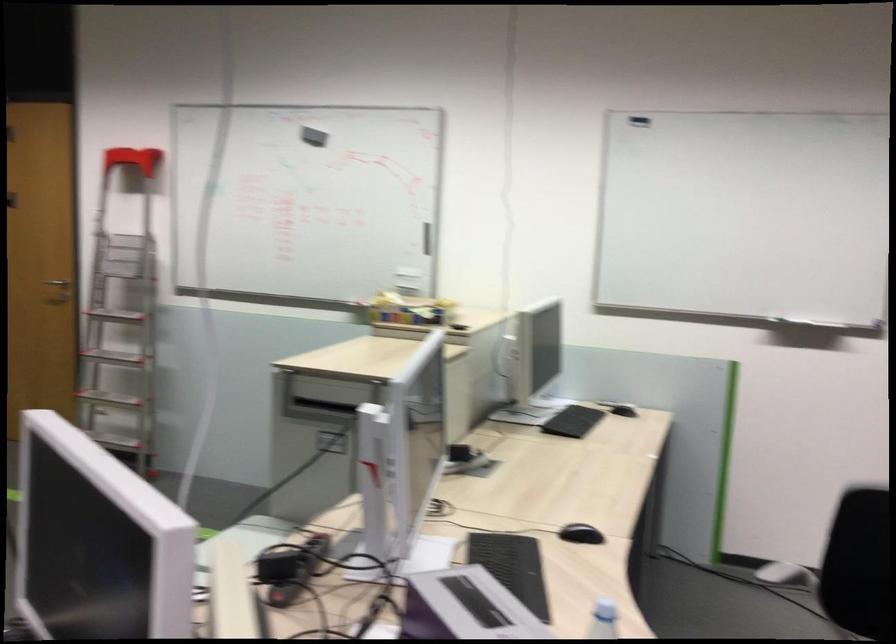
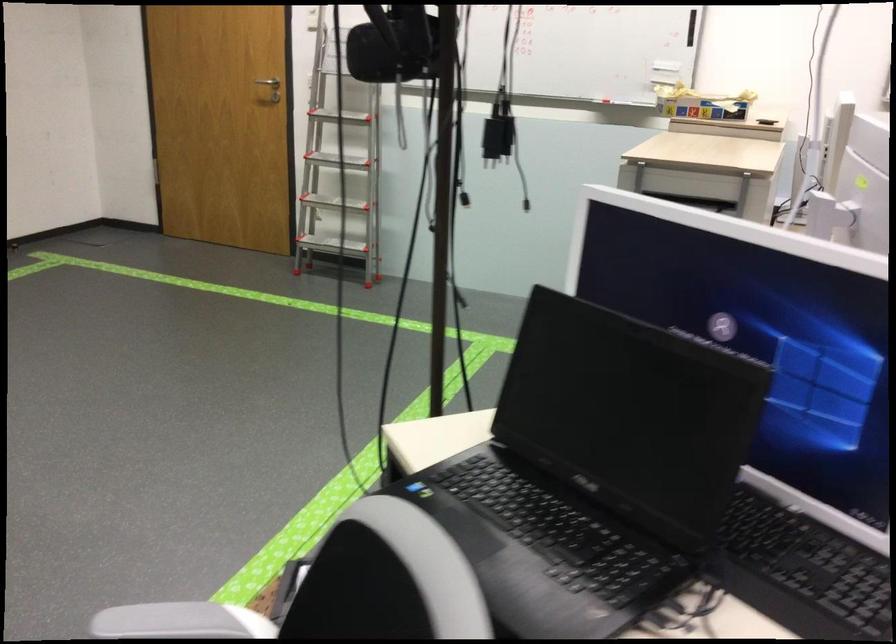
Question: In a continuous first-person perspective shot, in which direction is the camera moving?

Choices:
 (A) Left
 (B) Right
 (C) Forward
 (D) Backward

Answer: (A)